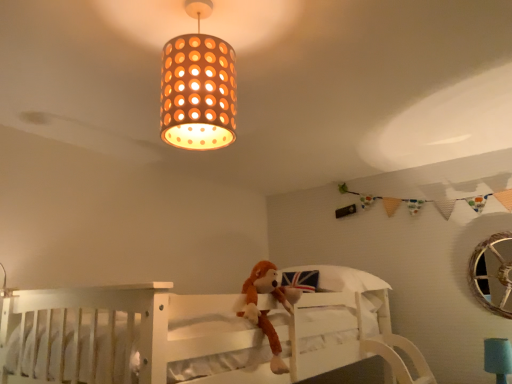
Question: From a real-world perspective, is orange perforated paper lampshade at upper center positioned under brown plush monkey at center based on gravity?

Choices:
 (A) yes
 (B) no

Answer: (B)

Question: From the image's perspective, is orange perforated paper lampshade at upper center on brown plush monkey at center?

Choices:
 (A) yes
 (B) no

Answer: (A)

Question: Is orange perforated paper lampshade at upper center looking in the opposite direction of brown plush monkey at center?

Choices:
 (A) yes
 (B) no

Answer: (B)

Question: Is orange perforated paper lampshade at upper center completely or partially outside of brown plush monkey at center?

Choices:
 (A) yes
 (B) no

Answer: (A)

Question: Is orange perforated paper lampshade at upper center not close to brown plush monkey at center?

Choices:
 (A) yes
 (B) no

Answer: (B)

Question: Does point (31, 336) appear closer or farther from the camera than point (179, 122)?

Choices:
 (A) closer
 (B) farther

Answer: (B)

Question: From the image's perspective, is white wooden bunk bed at center positioned above or below orange perforated paper lampshade at upper center?

Choices:
 (A) below
 (B) above

Answer: (A)

Question: Is white wooden bunk bed at center taller or shorter than orange perforated paper lampshade at upper center?

Choices:
 (A) tall
 (B) short

Answer: (A)

Question: In terms of size, does white wooden bunk bed at center appear bigger or smaller than orange perforated paper lampshade at upper center?

Choices:
 (A) big
 (B) small

Answer: (A)

Question: Considering the positions of point (485, 345) and point (399, 380), is point (485, 345) closer or farther from the camera than point (399, 380)?

Choices:
 (A) closer
 (B) farther

Answer: (B)

Question: From the image's perspective, is teal fabric lampshade at lower right positioned above or below white wooden bunk bed at center?

Choices:
 (A) above
 (B) below

Answer: (B)

Question: From a real-world perspective, relative to white wooden bunk bed at center, is teal fabric lampshade at lower right vertically above or below?

Choices:
 (A) above
 (B) below

Answer: (B)

Question: Considering the positions of teal fabric lampshade at lower right and white wooden bunk bed at center in the image, is teal fabric lampshade at lower right wider or thinner than white wooden bunk bed at center?

Choices:
 (A) wide
 (B) thin

Answer: (B)

Question: Is orange perforated paper lampshade at upper center inside the boundaries of brown plush monkey at center, or outside?

Choices:
 (A) outside
 (B) inside

Answer: (A)

Question: In terms of height, does orange perforated paper lampshade at upper center look taller or shorter compared to brown plush monkey at center?

Choices:
 (A) short
 (B) tall

Answer: (A)